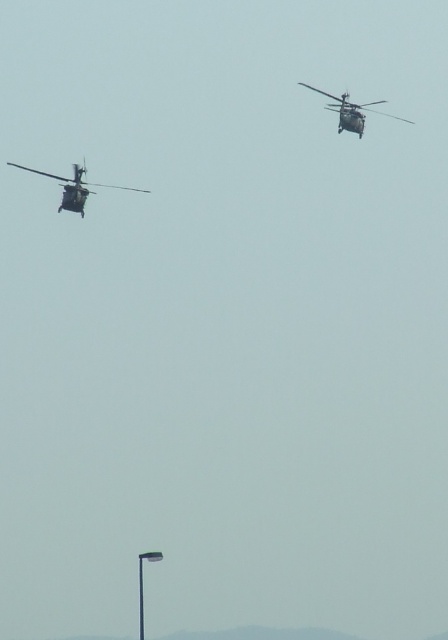
You are a drone operator controlling a drone that has a maximum flight range of 100 meters. You want to fly your drone to the metallic gray helicopter at left. Can your drone reach it?

The metallic gray helicopter at left is 98.96 meters away from viewer. Since the drone has a maximum flight range of 100 meters, the drone can reach it as the distance is within the range.

You are a drone operator controlling a small drone that needs to fly between the two helicopters. The maximum distance your drone can travel in one flight is 15 meters. Can your drone safely fly from the metallic gray helicopter at left to the metallic gray helicopter at upper right without needing to recharge?

The distance between the metallic gray helicopter at left and the metallic gray helicopter at upper right is 16.75 meters, which exceeds the drone operator maximum flight range of 15 meters. Therefore, the drone cannot safely fly between them without recharging.